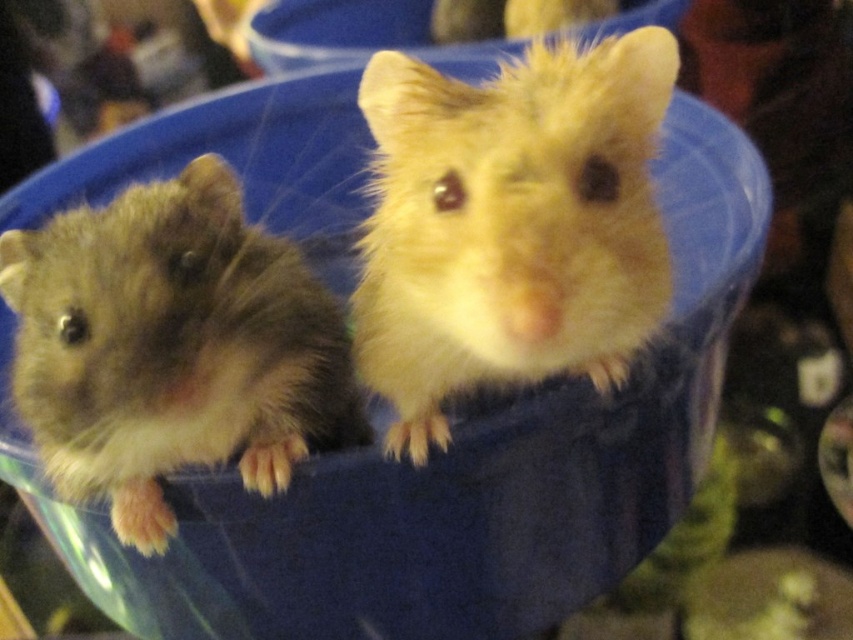
You are a pet store employee who needs to place a new hamster toy between the fluffy golden hamster at center and the fuzzy brown hamster at left. Based on their positions, which hamster will the toy be closer to?

The toy will be closer to the fluffy golden hamster at center because it is positioned to the right of the fuzzy brown hamster at left.

You are a veterinarian examining a hamster enclosure. The enclosure has a point marked at coordinates (509,225). Which hamster is located at that point?

The point at coordinates (509,225) corresponds to the fluffy golden hamster at center.

You are a pet store employee who needs to separate the fluffy golden hamster at center and the fuzzy brown hamster at left into individual containers. The minimum required distance between their containers is 9 inches to prevent stress. Based on their current positions, will the containers need to be moved further apart?

The fluffy golden hamster at center and the fuzzy brown hamster at left are currently 8.91 inches apart, which is less than the required 9 inches. Therefore, the containers need to be moved further apart to meet the minimum distance requirement.